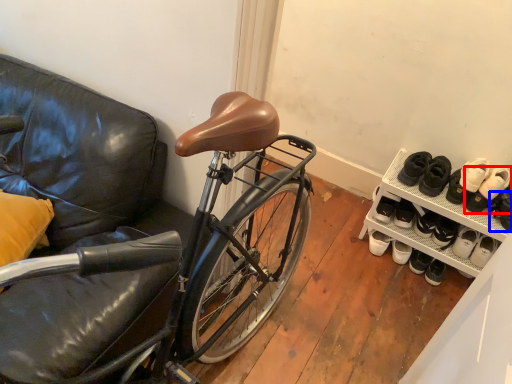
Question: Among these objects, which one is nearest to the camera, footwear (highlighted by a red box) or shoe (highlighted by a blue box)?

Choices:
 (A) footwear
 (B) shoe

Answer: (B)